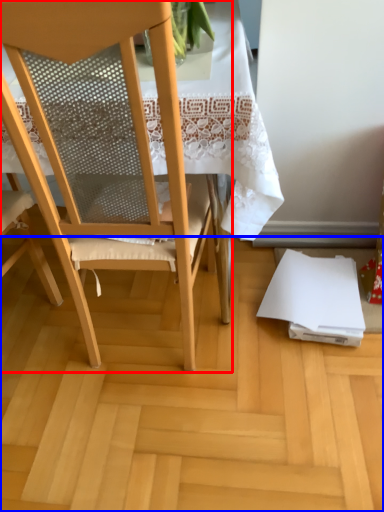
Question: Which object appears farthest to the camera in this image, chair (highlighted by a red box) or plywood (highlighted by a blue box)?

Choices:
 (A) chair
 (B) plywood

Answer: (B)